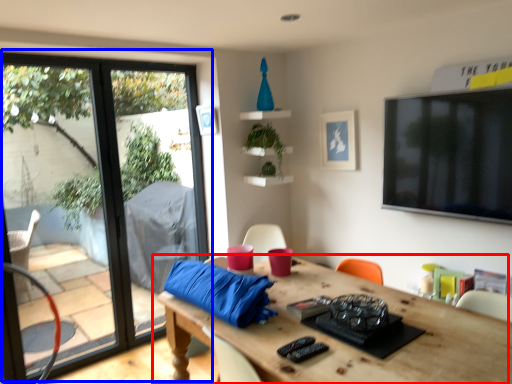
Question: Among these objects, which one is nearest to the camera, table (highlighted by a red box) or window (highlighted by a blue box)?

Choices:
 (A) table
 (B) window

Answer: (A)